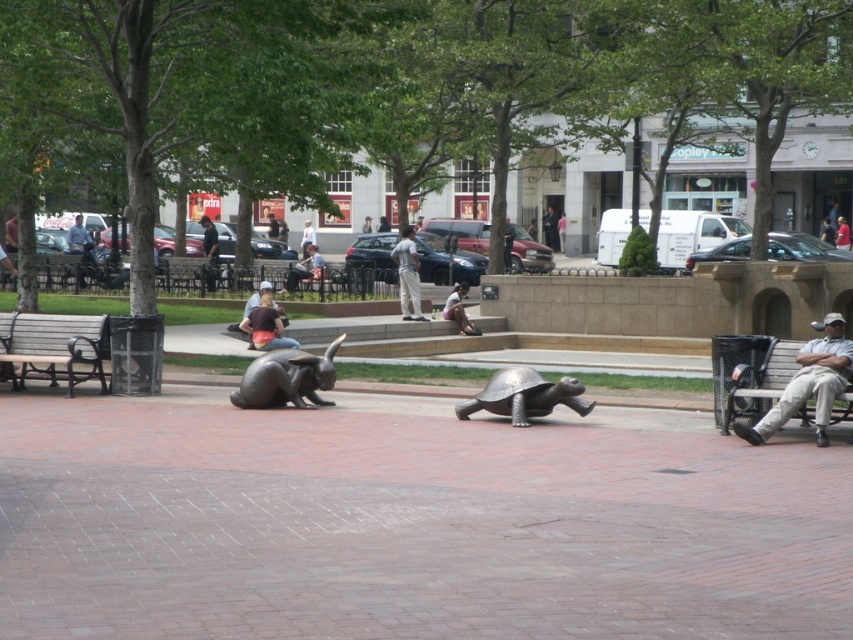
Is light brown wooden bench at right shorter than denim jacket at center?

Incorrect, light brown wooden bench at right's height does not fall short of denim jacket at center's.

Is light brown wooden bench at right taller than denim jacket at center?

Yes, light brown wooden bench at right is taller than denim jacket at center.

Locate an element on the screen. The width and height of the screenshot is (853, 640). light brown wooden bench at right is located at coordinates (809, 384).

Where is `light brown wooden bench at right`? Image resolution: width=853 pixels, height=640 pixels. light brown wooden bench at right is located at coordinates (809, 384).

From the picture: Can you confirm if brushed metal tortoise at center is positioned below denim jacket at center?

Indeed, brushed metal tortoise at center is positioned under denim jacket at center.

Does brushed metal tortoise at center have a greater height compared to denim jacket at center?

No.

Is point (518, 424) closer to camera compared to point (273, 321)?

Yes, it is in front of point (273, 321).

Locate an element on the screen. This screenshot has width=853, height=640. brushed metal tortoise at center is located at coordinates click(524, 396).

Can you confirm if wooden bench at left is positioned below light brown leather jacket at center?

Yes.

Is wooden bench at left above light brown leather jacket at center?

Incorrect, wooden bench at left is not positioned above light brown leather jacket at center.

Locate an element on the screen. wooden bench at left is located at coordinates (53, 346).

Where is `wooden bench at left`? This screenshot has height=640, width=853. wooden bench at left is located at coordinates (53, 346).